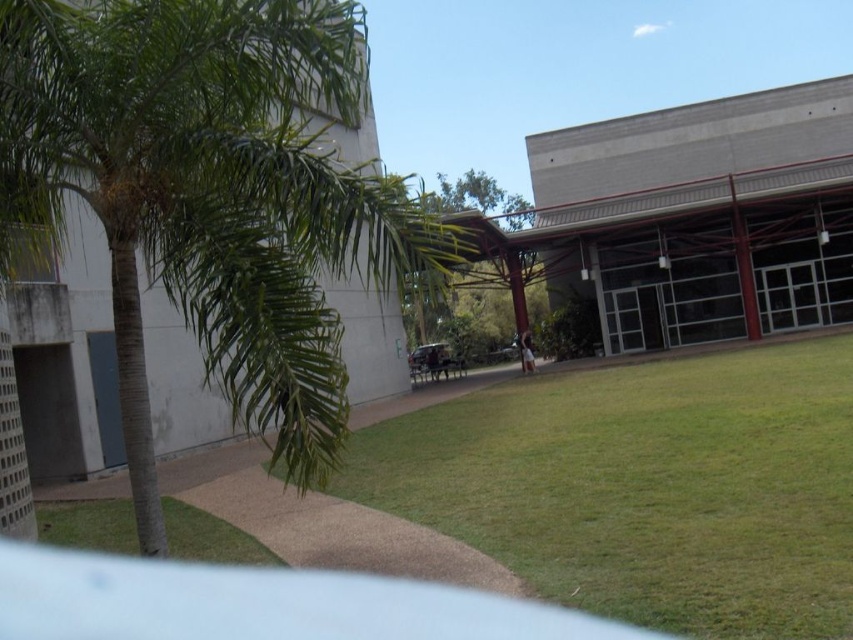
Which is in front, point (311, 360) or point (445, 312)?

Point (311, 360) is more forward.

Is green leafy palm tree at left to the left of green leafy tree at center from the viewer's perspective?

Yes, green leafy palm tree at left is to the left of green leafy tree at center.

Which is behind, point (181, 285) or point (468, 296)?

Point (468, 296)

Where is `green leafy palm tree at left`? The height and width of the screenshot is (640, 853). green leafy palm tree at left is located at coordinates (210, 196).